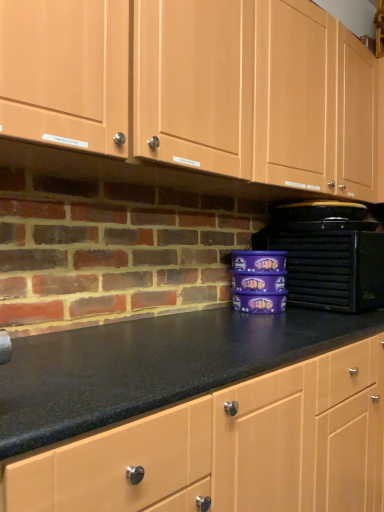
Locate an element on the screen. The image size is (384, 512). matte wood cabinets at upper center is located at coordinates (245, 104).

Describe the element at coordinates (245, 104) in the screenshot. I see `matte wood cabinets at upper center` at that location.

In order to face matte wood cabinets at upper center, should I rotate leftwards or rightwards?

Rotate right and turn 7.165 degrees.

Where is `black plastic toaster at right`? The width and height of the screenshot is (384, 512). black plastic toaster at right is located at coordinates (329, 263).

Describe the element at coordinates (329, 263) in the screenshot. I see `black plastic toaster at right` at that location.

This screenshot has height=512, width=384. In order to click on matte wood cabinets at upper center in this screenshot , I will do `click(245, 104)`.

Visually, is black plastic toaster at right positioned to the left or to the right of matte wood cabinets at upper center?

In the image, black plastic toaster at right appears on the right side of matte wood cabinets at upper center.

Which object is closer to the camera, black plastic toaster at right or matte wood cabinets at upper center?

matte wood cabinets at upper center is more forward.

Between point (331, 268) and point (173, 172), which one is positioned in front?

The point (173, 172) is more forward.

From the image's perspective, is black plastic toaster at right above or below matte wood cabinets at upper center?

Based on their image positions, black plastic toaster at right is located beneath matte wood cabinets at upper center.

From a real-world perspective, does black plastic toaster at right stand above matte wood cabinets at upper center?

Actually, black plastic toaster at right is physically below matte wood cabinets at upper center in the real world.

In terms of width, does black plastic toaster at right look wider or thinner when compared to matte wood cabinets at upper center?

black plastic toaster at right is wider than matte wood cabinets at upper center.

In terms of height, does black plastic toaster at right look taller or shorter compared to matte wood cabinets at upper center?

Considering their sizes, black plastic toaster at right has less height than matte wood cabinets at upper center.

Who is smaller, black plastic toaster at right or matte wood cabinets at upper center?

Smaller between the two is black plastic toaster at right.

Choose the correct answer: Is black plastic toaster at right inside matte wood cabinets at upper center or outside it?

black plastic toaster at right cannot be found inside matte wood cabinets at upper center.

Is black plastic toaster at right touching matte wood cabinets at upper center?

There is a gap between black plastic toaster at right and matte wood cabinets at upper center.

Is black plastic toaster at right aimed at matte wood cabinets at upper center?

No, black plastic toaster at right does not turn towards matte wood cabinets at upper center.

How far apart are black plastic toaster at right and matte wood cabinets at upper center?

19.25 inches.

Find the location of `cabinetry above the black plastic toaster at right (from the image's perspective)`. cabinetry above the black plastic toaster at right (from the image's perspective) is located at coordinates (245, 104).

Between matte wood cabinets at upper center and black plastic toaster at right, which one appears on the left side from the viewer's perspective?

matte wood cabinets at upper center.

Which object is further away from the camera, matte wood cabinets at upper center or black plastic toaster at right?

black plastic toaster at right.

Considering the positions of point (352, 88) and point (298, 264), is point (352, 88) closer or farther from the camera than point (298, 264)?

Point (352, 88).

From the image's perspective, is matte wood cabinets at upper center located above black plastic toaster at right?

Yes, from the image's perspective, matte wood cabinets at upper center is on top of black plastic toaster at right.

From a real-world perspective, is matte wood cabinets at upper center positioned over black plastic toaster at right based on gravity?

Yes, from a real-world perspective, matte wood cabinets at upper center is on top of black plastic toaster at right.

Can you confirm if matte wood cabinets at upper center is wider than black plastic toaster at right?

No, matte wood cabinets at upper center is not wider than black plastic toaster at right.

Is matte wood cabinets at upper center shorter than black plastic toaster at right?

In fact, matte wood cabinets at upper center may be taller than black plastic toaster at right.

Who is bigger, matte wood cabinets at upper center or black plastic toaster at right?

With larger size is matte wood cabinets at upper center.

Is black plastic toaster at right a part of matte wood cabinets at upper center?

No.

Are matte wood cabinets at upper center and black plastic toaster at right beside each other?

matte wood cabinets at upper center and black plastic toaster at right are clearly separated.

Is matte wood cabinets at upper center oriented away from black plastic toaster at right?

matte wood cabinets at upper center is not turned away from black plastic toaster at right.

How different are the orientations of matte wood cabinets at upper center and black plastic toaster at right in degrees?

0.364 degrees separate the facing orientations of matte wood cabinets at upper center and black plastic toaster at right.

How far apart are matte wood cabinets at upper center and black plastic toaster at right?

48.90 centimeters.

Locate an element on the screen. The image size is (384, 512). home appliance beneath the matte wood cabinets at upper center (from a real-world perspective) is located at coordinates (329, 263).

This screenshot has height=512, width=384. What are the coordinates of `cabinetry lying above the black plastic toaster at right (from the image's perspective)` in the screenshot? It's located at (245, 104).

This screenshot has height=512, width=384. Identify the location of cabinetry on the left side of black plastic toaster at right. (245, 104).